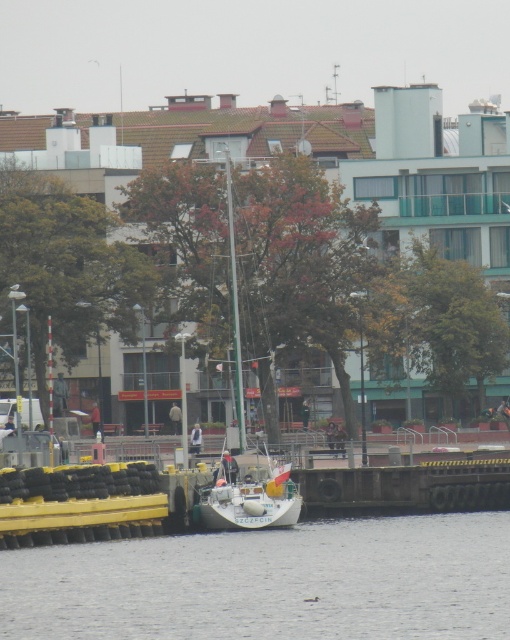
Question: Which of the following is the farthest from the observer?

Choices:
 (A) clear water at lower center
 (B) white matte sailboat at center

Answer: (B)

Question: From the image, what is the correct spatial relationship of clear water at lower center in relation to white matte sailboat at center?

Choices:
 (A) left
 (B) right

Answer: (B)

Question: Which point appears farthest from the camera in this image?

Choices:
 (A) (84, 561)
 (B) (240, 388)

Answer: (B)

Question: Does clear water at lower center appear over white matte sailboat at center?

Choices:
 (A) yes
 (B) no

Answer: (B)

Question: Which object appears closest to the camera in this image?

Choices:
 (A) clear water at lower center
 (B) white matte sailboat at center

Answer: (A)

Question: In this image, where is clear water at lower center located relative to white matte sailboat at center?

Choices:
 (A) left
 (B) right

Answer: (B)